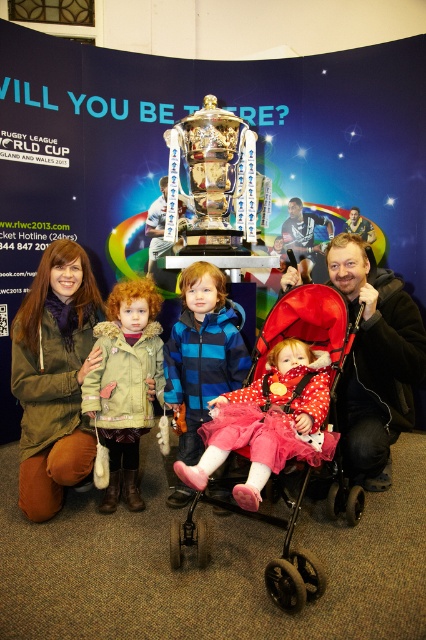
Question: Does green fuzzy coat at center have a greater width compared to red fabric baby carriage at center?

Choices:
 (A) yes
 (B) no

Answer: (B)

Question: Is matte olive green jacket at center below polka dot fabric dress at center?

Choices:
 (A) yes
 (B) no

Answer: (B)

Question: Considering the real-world distances, which object is farthest from the gold shiny trophy at center?

Choices:
 (A) matte olive green jacket at center
 (B) polka dot fabric dress at center

Answer: (B)

Question: Which point is farther from the camera taking this photo?

Choices:
 (A) (298, 454)
 (B) (178, 401)
 (C) (310, 460)
 (D) (62, 298)

Answer: (D)

Question: Based on their relative distances, which object is farther from the red fabric baby carriage at center?

Choices:
 (A) gold shiny trophy at center
 (B) matte olive green jacket at center

Answer: (A)

Question: Is green fuzzy coat at center positioned at the back of blue fleece jacket at center?

Choices:
 (A) yes
 (B) no

Answer: (B)